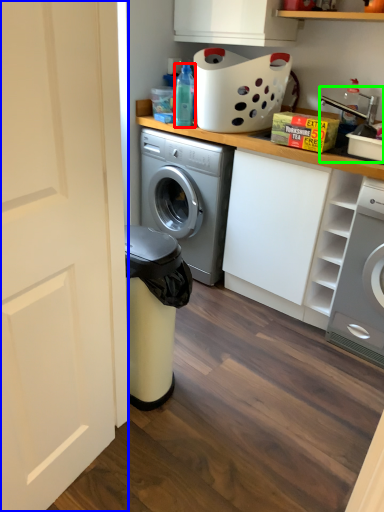
Question: Estimate the real-world distances between objects in this image. Which object is closer to bottle (highlighted by a red box), door (highlighted by a blue box) or sink (highlighted by a green box)?

Choices:
 (A) door
 (B) sink

Answer: (B)